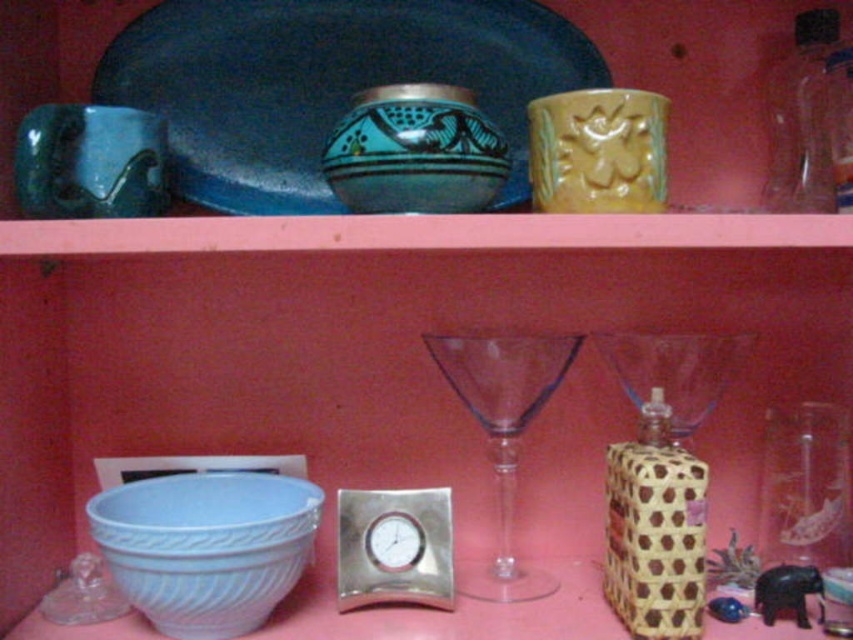
Question: Does blue matte plate at upper center have a lesser width compared to transparent glass wine glass at center?

Choices:
 (A) yes
 (B) no

Answer: (B)

Question: Which point is farther to the camera?

Choices:
 (A) (248, 198)
 (B) (682, 602)

Answer: (A)

Question: Based on their relative distances, which object is nearer to the matte blue cup at upper left?

Choices:
 (A) yellow matte cup at upper center
 (B) brown woven bottle at lower right
 (C) blue matte plate at upper center
 (D) transparent glass wine glass at center

Answer: (C)

Question: Estimate the real-world distances between objects in this image. Which object is farther from the brown woven bottle at lower right?

Choices:
 (A) yellow matte cup at upper center
 (B) transparent plastic bottle at upper right

Answer: (B)

Question: Considering the relative positions of yellow matte cup at upper center and matte blue cup at upper left in the image provided, where is yellow matte cup at upper center located with respect to matte blue cup at upper left?

Choices:
 (A) left
 (B) right

Answer: (B)

Question: From the image, what is the correct spatial relationship of matte blue cup at upper left in relation to transparent plastic bottle at upper right?

Choices:
 (A) left
 (B) right

Answer: (A)